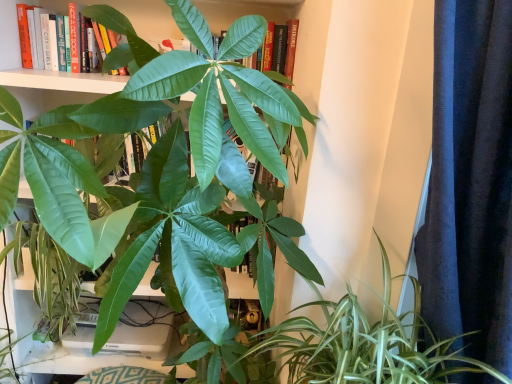
Question: Is green glossy leafy plant at lower right at the right side of dark blue textured curtain at right?

Choices:
 (A) no
 (B) yes

Answer: (A)

Question: From the image's perspective, is green glossy leafy plant at lower right above dark blue textured curtain at right?

Choices:
 (A) no
 (B) yes

Answer: (A)

Question: Is green glossy leafy plant at lower right closer to camera compared to dark blue textured curtain at right?

Choices:
 (A) yes
 (B) no

Answer: (B)

Question: Considering the relative sizes of green glossy leafy plant at lower right and dark blue textured curtain at right in the image provided, is green glossy leafy plant at lower right wider than dark blue textured curtain at right?

Choices:
 (A) yes
 (B) no

Answer: (B)

Question: Can we say green glossy leafy plant at lower right lies outside dark blue textured curtain at right?

Choices:
 (A) yes
 (B) no

Answer: (B)

Question: Considering their positions, is green matte leaf at upper center located in front of or behind green glossy leafy plant at lower right?

Choices:
 (A) front
 (B) behind

Answer: (B)

Question: From a real-world perspective, is green matte leaf at upper center physically located above or below green glossy leafy plant at lower right?

Choices:
 (A) below
 (B) above

Answer: (B)

Question: Would you say green matte leaf at upper center is inside or outside green glossy leafy plant at lower right?

Choices:
 (A) outside
 (B) inside

Answer: (A)

Question: Based on their sizes in the image, would you say green matte leaf at upper center is bigger or smaller than green glossy leafy plant at lower right?

Choices:
 (A) big
 (B) small

Answer: (B)

Question: Looking at their shapes, would you say dark blue textured curtain at right is wider or thinner than green matte leaf at upper center?

Choices:
 (A) thin
 (B) wide

Answer: (B)

Question: Considering their positions, is dark blue textured curtain at right located in front of or behind green matte leaf at upper center?

Choices:
 (A) front
 (B) behind

Answer: (A)

Question: From a real-world perspective, relative to green matte leaf at upper center, is dark blue textured curtain at right vertically above or below?

Choices:
 (A) below
 (B) above

Answer: (A)

Question: Is point (430, 221) closer or farther from the camera than point (95, 18)?

Choices:
 (A) closer
 (B) farther

Answer: (A)

Question: Is point (399, 360) positioned closer to the camera than point (126, 33)?

Choices:
 (A) farther
 (B) closer

Answer: (A)

Question: From their relative heights in the image, would you say green glossy leafy plant at lower right is taller or shorter than green matte leaf at upper center?

Choices:
 (A) short
 (B) tall

Answer: (B)